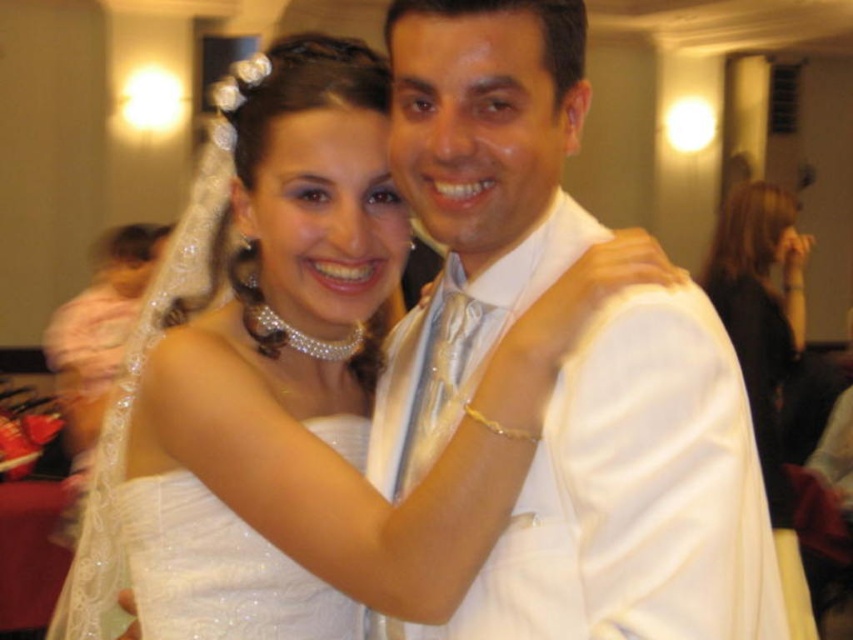
You are a photographer standing at point (747, 604). The bride and groom are in front of you. Can you fit both of them in your camera frame if your camera has a 1.0 meter field of view?

The bride and groom are 1.05 meters apart, so they are slightly further apart than the camera field of view of 1.0 meter. Therefore, you cannot fit both of them in the camera frame.

In the image of the wedding scene, the bride is wearing a white satin dress at center and the groom has a white satin shirt at center. From the perspective of someone facing the couple, which item is positioned to the left?

The white satin dress at center is to the left of the white satin shirt at center.